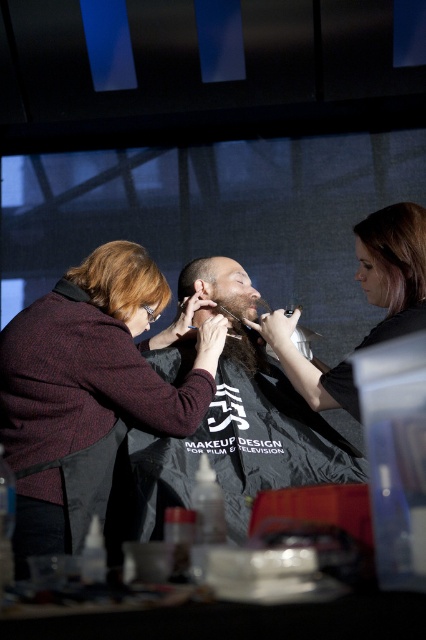
You are a costume designer preparing for a film scene. You need to ensure that the maroon woolen sweater at upper left and the blonde smooth hair at upper right are visible to the camera. Based on their sizes, which one is more likely to be in the foreground?

The maroon woolen sweater at upper left has a larger size compared to the blonde smooth hair at upper right, so it is more likely to be in the foreground.

You are a costume designer preparing for a scene where two characters with different hair widths need distinct accessories. Given the blonde smooth hair at upper right and the dark brown hair at center, which character should you choose for a wider headband that requires more hair coverage?

The blonde smooth hair at upper right has a greater width than the dark brown hair at center, so the wider headband should be chosen for the character with the blonde smooth hair at upper right to ensure proper coverage.

You are a costume designer observing the grooming scene. You need to determine which item is higher in the image to adjust lighting. Which is taller, the maroon woolen sweater at upper left or the blonde smooth hair at upper right?

The maroon woolen sweater at upper left is taller than the blonde smooth hair at upper right according to the description.